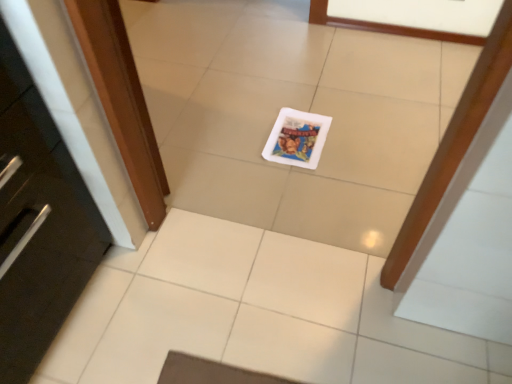
At what (x,y) coordinates should I click in order to perform the action: click on vacant space in front of white matte postcard at center. Please return your answer as a coordinate pair (x, y). Looking at the image, I should click on pyautogui.click(x=307, y=189).